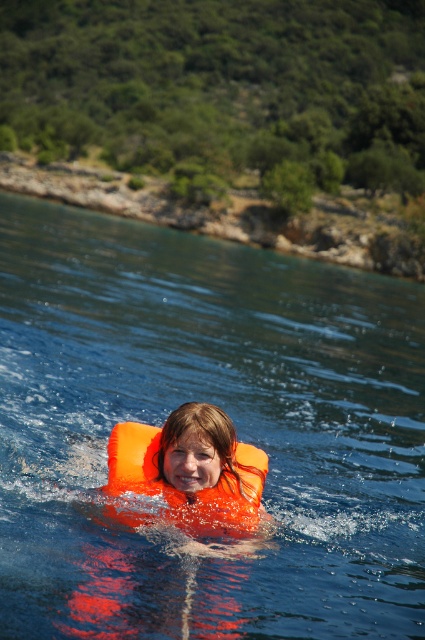
Is transparent orange life vest at center to the right of orange inflatable at center from the viewer's perspective?

Incorrect, transparent orange life vest at center is not on the right side of orange inflatable at center.

Between transparent orange life vest at center and orange inflatable at center, which one is positioned lower?

orange inflatable at center is below.

Find the location of `transparent orange life vest at center`. transparent orange life vest at center is located at coordinates (223, 410).